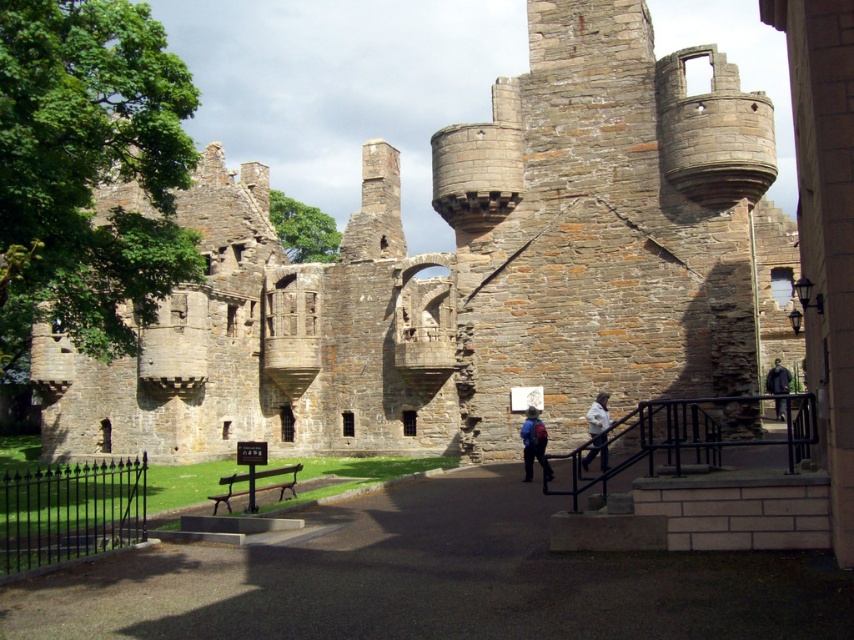
Question: Is white cotton jacket at lower center below dark blue fabric jacket at right?

Choices:
 (A) yes
 (B) no

Answer: (A)

Question: In this image, where is white cotton jacket at lower center located relative to dark blue fabric jacket at right?

Choices:
 (A) left
 (B) right

Answer: (A)

Question: Which of the following is the closest to the observer?

Choices:
 (A) brown stone castle at center
 (B) dark blue fabric jacket at right

Answer: (B)

Question: Does blue backpack at center have a larger size compared to white cotton jacket at lower center?

Choices:
 (A) no
 (B) yes

Answer: (A)

Question: Among these objects, which one is farthest from the camera?

Choices:
 (A) dark blue fabric jacket at right
 (B) brown stone castle at center
 (C) blue backpack at center

Answer: (B)

Question: Among these points, which one is farthest from the camera?

Choices:
 (A) (540, 420)
 (B) (781, 416)
 (C) (623, 61)

Answer: (B)